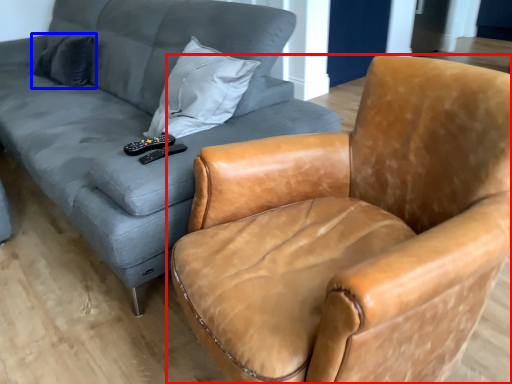
Question: Which object is closer to the camera taking this photo, chair (highlighted by a red box) or pillow (highlighted by a blue box)?

Choices:
 (A) chair
 (B) pillow

Answer: (A)